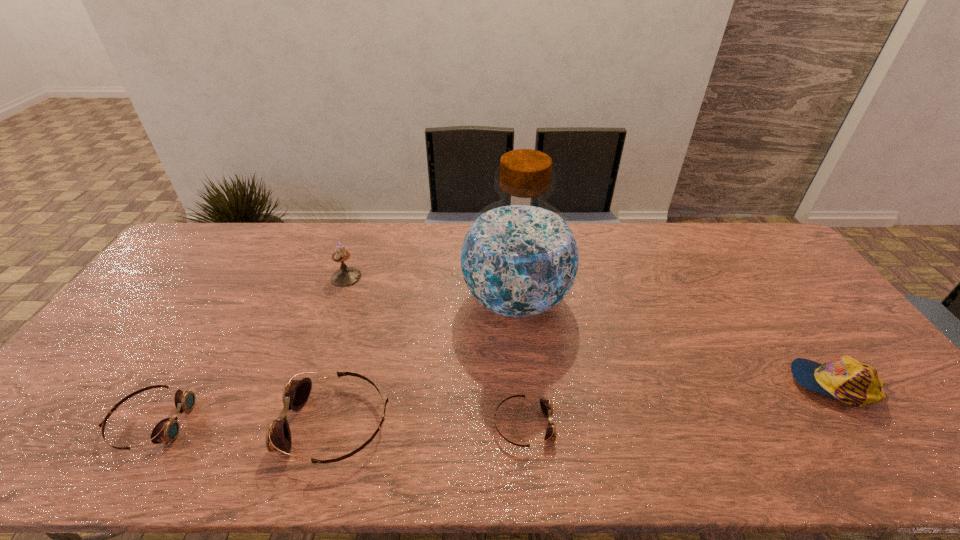
Please point a free position for a goggles on the right. Please provide its 2D coordinates. Your answer should be formatted as a tuple, i.e. [(x, y)], where the tuple contains the x and y coordinates of a point satisfying the conditions above.

[(710, 426)]